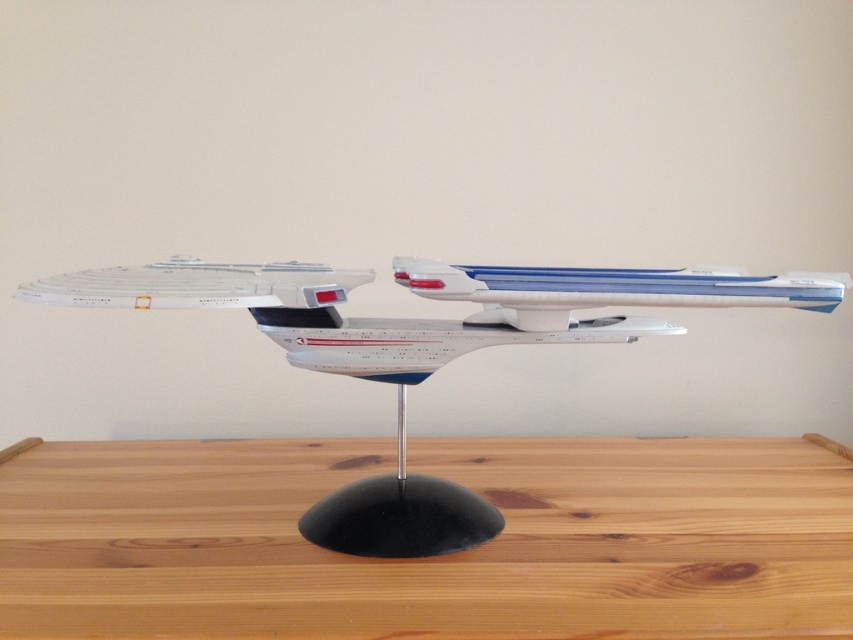
Question: Considering the real-world distances, which object is farthest from the light brown wood table at center?

Choices:
 (A) white plastic airplane at center
 (B) white plastic starship at center

Answer: (A)

Question: Is the position of light brown wood table at center more distant than that of white plastic starship at center?

Choices:
 (A) no
 (B) yes

Answer: (A)

Question: Which of the following is the closest to the observer?

Choices:
 (A) (421, 259)
 (B) (497, 275)

Answer: (B)

Question: Can you confirm if white plastic starship at center is positioned above white plastic airplane at center?

Choices:
 (A) yes
 (B) no

Answer: (B)

Question: Which point is closer to the camera taking this photo?

Choices:
 (A) pyautogui.click(x=129, y=552)
 (B) pyautogui.click(x=576, y=275)

Answer: (B)

Question: From the image, what is the correct spatial relationship of white plastic starship at center in relation to white plastic airplane at center?

Choices:
 (A) right
 (B) left

Answer: (B)